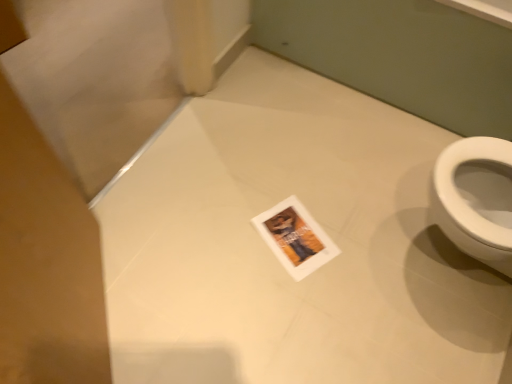
I want to click on white paper postcard at center, so click(x=295, y=238).

What do you see at coordinates (295, 238) in the screenshot?
I see `white paper postcard at center` at bounding box center [295, 238].

At what (x,y) coordinates should I click in order to perform the action: click on white paper postcard at center. Please return your answer as a coordinate pair (x, y). Looking at the image, I should click on (295, 238).